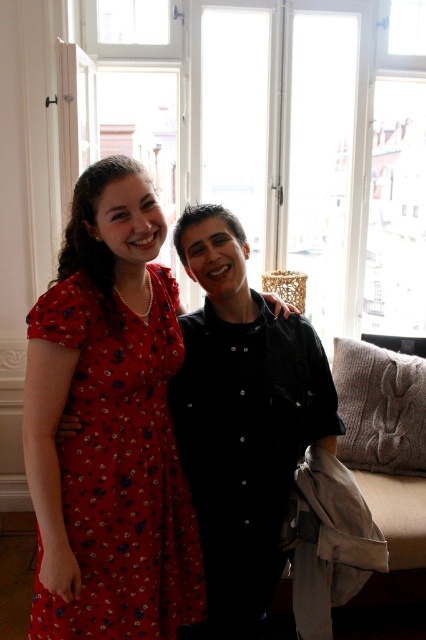
Is floral print fabric dress at left in front of black button-up shirt at center?

Yes, it is in front of black button-up shirt at center.

At what (x,y) coordinates should I click in order to perform the action: click on floral print fabric dress at left. Please return your answer as a coordinate pair (x, y). This screenshot has width=426, height=640. Looking at the image, I should click on click(120, 468).

Which is in front, point (163, 576) or point (218, 492)?

Point (163, 576) is in front.

The height and width of the screenshot is (640, 426). Find the location of `floral print fabric dress at left`. floral print fabric dress at left is located at coordinates (120, 468).

In the scene shown: Is transparent glass window at upper center to the right of floral print fabric dress at left from the viewer's perspective?

Indeed, transparent glass window at upper center is positioned on the right side of floral print fabric dress at left.

Identify the location of transparent glass window at upper center. (313, 150).

Who is higher up, transparent glass window at upper center or black button-up shirt at center?

transparent glass window at upper center is above.

You are a GUI agent. You are given a task and a screenshot of the screen. Output one action in this format:
    pyautogui.click(x=<x>, y=<y>)
    Task: Click on the transparent glass window at upper center
    This screenshot has height=640, width=426.
    Given the screenshot: What is the action you would take?
    pyautogui.click(x=313, y=150)

Is point (328, 209) positioned after point (256, 451)?

That is True.

Locate an element on the screen. This screenshot has width=426, height=640. transparent glass window at upper center is located at coordinates (313, 150).